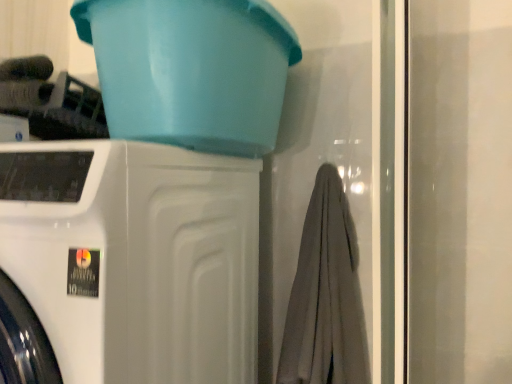
Question: Is matte plastic basin at upper center directly adjacent to white glossy washing machine at left?

Choices:
 (A) no
 (B) yes

Answer: (A)

Question: Considering the relative positions of matte plastic basin at upper center and white glossy washing machine at left in the image provided, is matte plastic basin at upper center to the left of white glossy washing machine at left from the viewer's perspective?

Choices:
 (A) no
 (B) yes

Answer: (A)

Question: From a real-world perspective, does matte plastic basin at upper center sit lower than white glossy washing machine at left?

Choices:
 (A) yes
 (B) no

Answer: (B)

Question: Considering the relative sizes of matte plastic basin at upper center and white glossy washing machine at left in the image provided, is matte plastic basin at upper center bigger than white glossy washing machine at left?

Choices:
 (A) no
 (B) yes

Answer: (A)

Question: Would you say white glossy washing machine at left is part of matte plastic basin at upper center's contents?

Choices:
 (A) yes
 (B) no

Answer: (B)

Question: Does point (347, 301) appear closer or farther from the camera than point (52, 329)?

Choices:
 (A) farther
 (B) closer

Answer: (A)

Question: Considering the positions of gray cotton bath towel at center and white glossy washing machine at left in the image, is gray cotton bath towel at center bigger or smaller than white glossy washing machine at left?

Choices:
 (A) small
 (B) big

Answer: (A)

Question: From a real-world perspective, relative to white glossy washing machine at left, is gray cotton bath towel at center vertically above or below?

Choices:
 (A) below
 (B) above

Answer: (B)

Question: Is gray cotton bath towel at center taller or shorter than white glossy washing machine at left?

Choices:
 (A) short
 (B) tall

Answer: (A)

Question: Is gray cotton bath towel at center wider or thinner than matte plastic basin at upper center?

Choices:
 (A) wide
 (B) thin

Answer: (B)

Question: From a real-world perspective, is gray cotton bath towel at center positioned above or below matte plastic basin at upper center?

Choices:
 (A) above
 (B) below

Answer: (B)

Question: From their relative heights in the image, would you say gray cotton bath towel at center is taller or shorter than matte plastic basin at upper center?

Choices:
 (A) short
 (B) tall

Answer: (B)

Question: Looking at the image, does gray cotton bath towel at center seem bigger or smaller compared to matte plastic basin at upper center?

Choices:
 (A) small
 (B) big

Answer: (A)

Question: Based on their sizes in the image, would you say white glossy washing machine at left is bigger or smaller than gray cotton bath towel at center?

Choices:
 (A) small
 (B) big

Answer: (B)

Question: Choose the correct answer: Is white glossy washing machine at left inside gray cotton bath towel at center or outside it?

Choices:
 (A) inside
 (B) outside

Answer: (B)